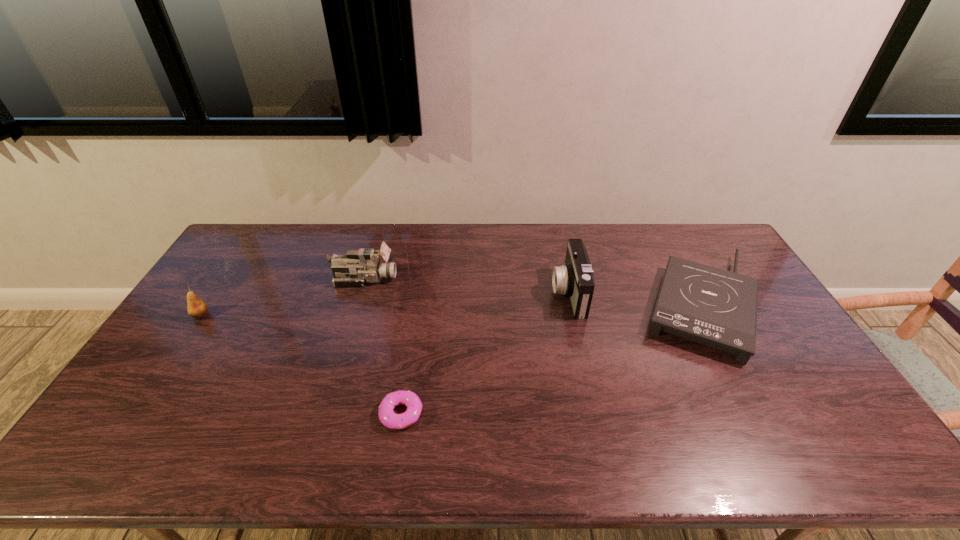
Where is `free spot at the near edge of the desktop`? The height and width of the screenshot is (540, 960). free spot at the near edge of the desktop is located at coordinates (644, 453).

I want to click on free point at the left edge, so click(160, 368).

You are a GUI agent. You are given a task and a screenshot of the screen. Output one action in this format:
    pyautogui.click(x=<x>, y=<y>)
    Task: Click on the vacant space at the far left corner of the desktop
    
    Given the screenshot: What is the action you would take?
    pyautogui.click(x=265, y=242)

Locate an element on the screen. The image size is (960, 540). free space between the second object from left to right and the doughnut is located at coordinates (383, 346).

You are a GUI agent. You are given a task and a screenshot of the screen. Output one action in this format:
    pyautogui.click(x=<x>, y=<y>)
    Task: Click on the free space between the shortest object and the second shortest object
    
    Given the screenshot: What is the action you would take?
    pyautogui.click(x=552, y=360)

Find the location of a particular element. vacant region between the fourth object from right to left and the third tallest object is located at coordinates (283, 297).

This screenshot has width=960, height=540. In order to click on free space between the left camcorder and the leftmost object in this screenshot , I will do `click(283, 297)`.

The width and height of the screenshot is (960, 540). I want to click on free space between the third shortest object and the fourth object from left to right, so pyautogui.click(x=385, y=304).

Where is `empty location between the left camcorder and the fourth object from left to right`? empty location between the left camcorder and the fourth object from left to right is located at coordinates (467, 286).

This screenshot has height=540, width=960. Identify the location of unoccupied position between the leftmost object and the left camcorder. [x=283, y=297].